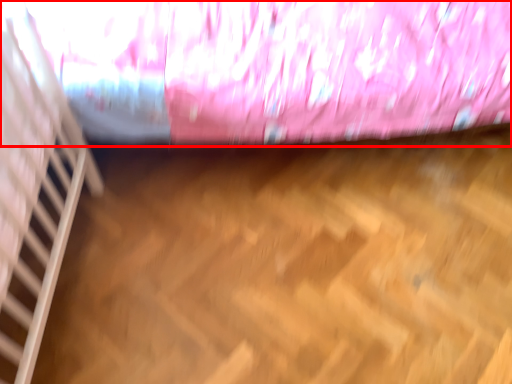
Question: Considering the relative positions of curtain (annotated by the red box) and stairwell in the image provided, where is curtain (annotated by the red box) located with respect to the staircase?

Choices:
 (A) right
 (B) left

Answer: (A)